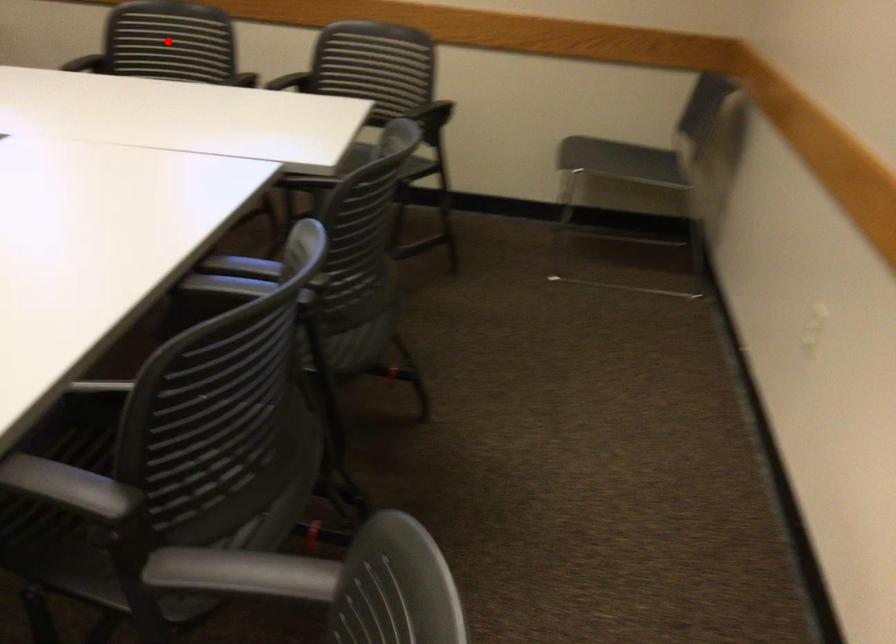
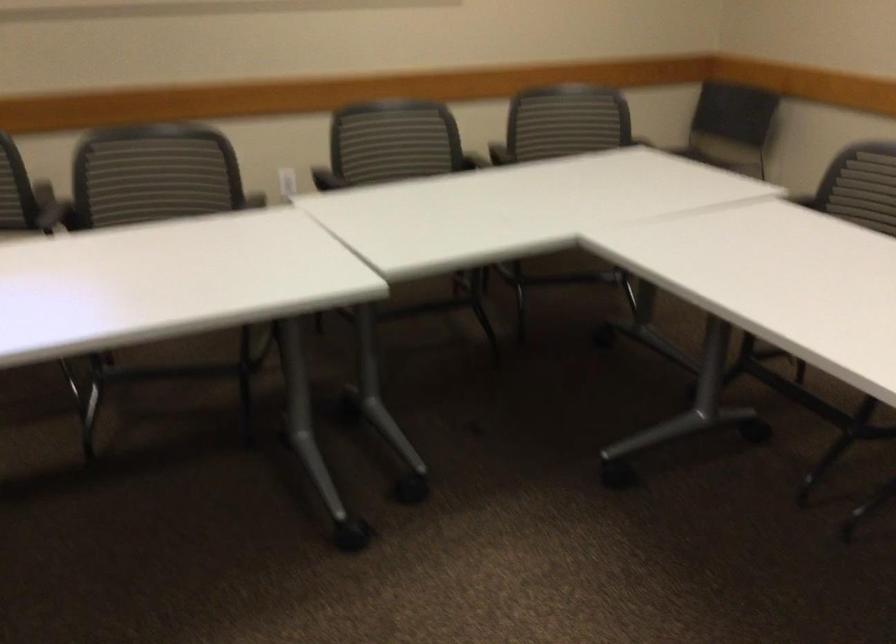
Question: I am providing you with two images of the same scene from different viewpoints. A red point is marked on the first image. At the location where the point appears in image 1, is it still visible in image 2?

Choices:
 (A) Yes
 (B) No

Answer: (B)